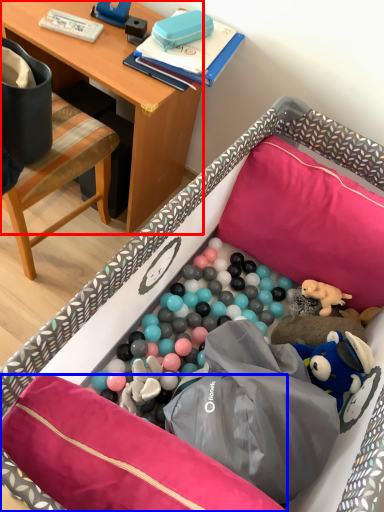
Question: Among these objects, which one is nearest to the camera, desk (highlighted by a red box) or pillow (highlighted by a blue box)?

Choices:
 (A) desk
 (B) pillow

Answer: (B)